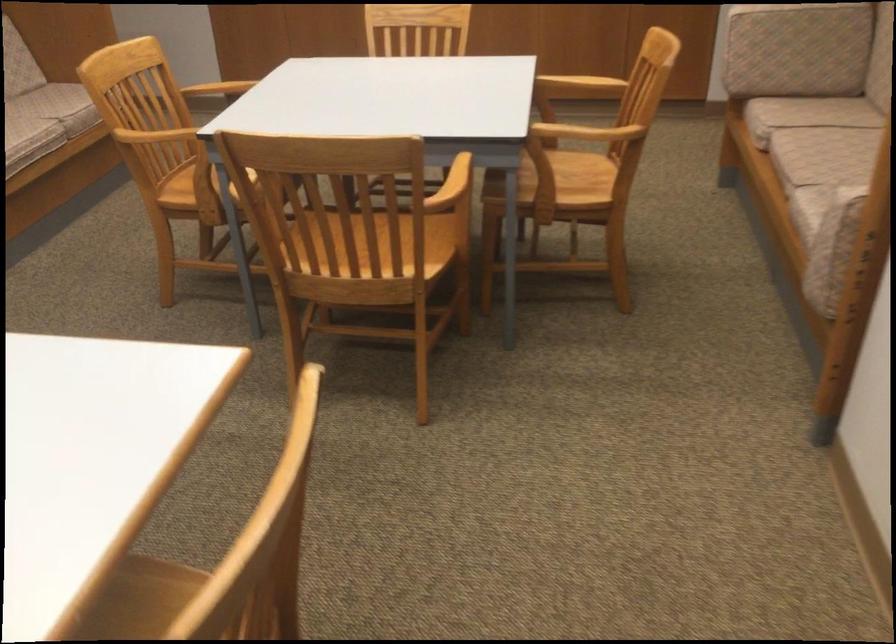
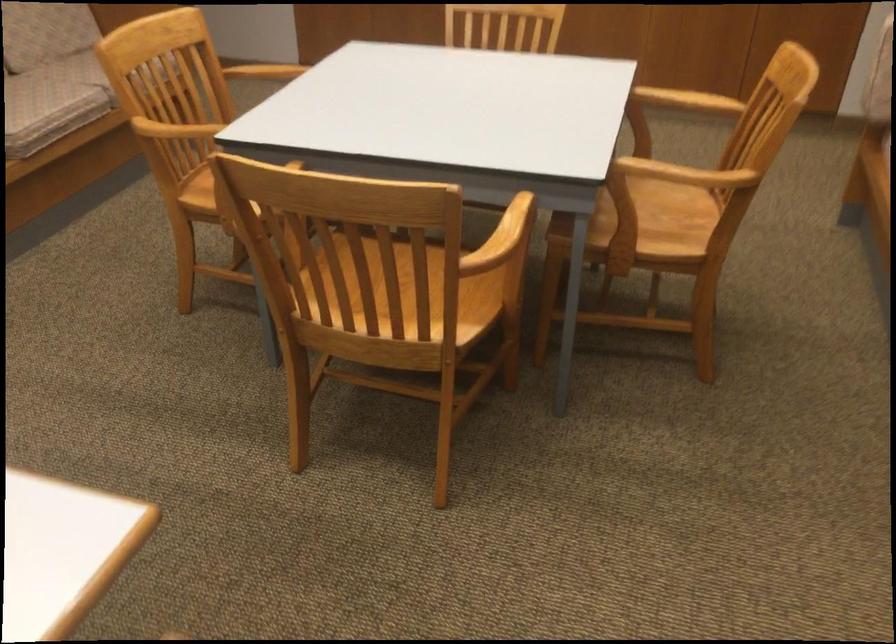
Question: How did the camera likely rotate?

Choices:
 (A) Left
 (B) Right
 (C) Up
 (D) Down

Answer: (A)